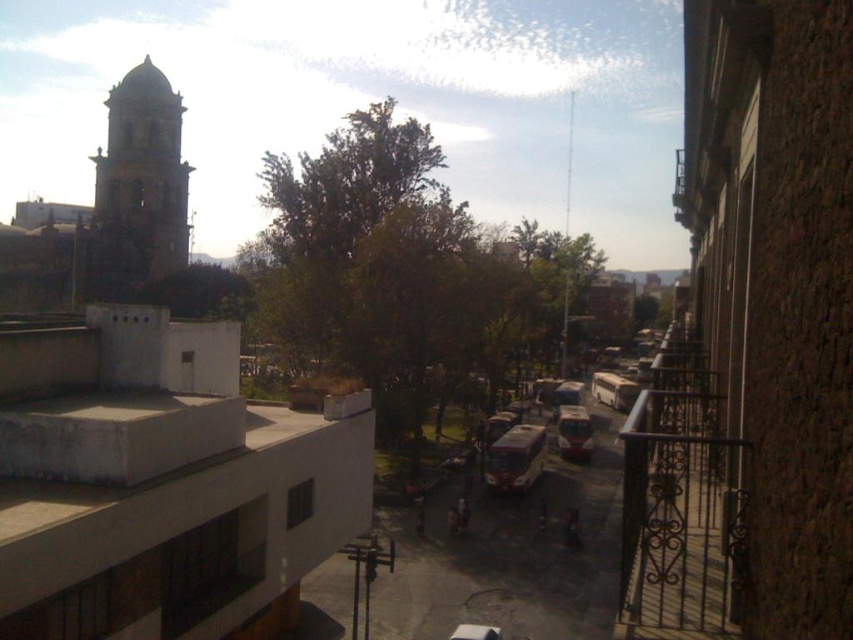
You are standing on a balcony in the city and want to locate the dark gray stone bell tower at upper left. According to the coordinates provided, where exactly is it positioned in the image?

The dark gray stone bell tower at upper left is positioned at coordinates point 0.287 on the x axis and 0.164 on the y axis.

You are a photographer trying to capture the metallic silver bus at center and the dark gray stone bell tower at upper left in the same frame. Based on their sizes in the image, which one do you think is closer to you?

The dark gray stone bell tower at upper left might be wider than metallic silver bus at center, so it is likely closer to the photographer since wider objects in the same frame are generally closer.

You are a drone operator who needs to fly a drone from the dark gray stone bell tower at upper left to the metallic silver bus at center. According to the scene, what is the minimum distance you must cover in feet?

The dark gray stone bell tower at upper left and metallic silver bus at center are 174.06 feet apart from each other, so the minimum distance you must cover is 174.06 feet.